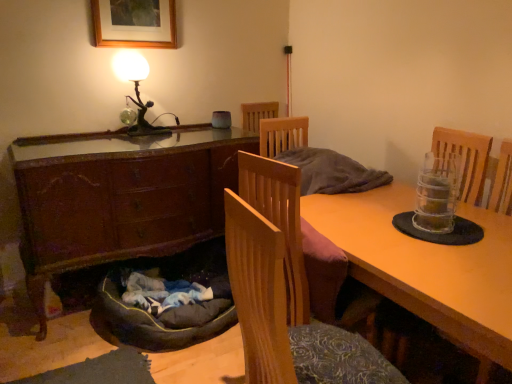
Question: Is wooden desk at center positioned beyond the bounds of wooden chair at center?

Choices:
 (A) yes
 (B) no

Answer: (A)

Question: Considering the relative positions of wooden desk at center and wooden chair at center in the image provided, is wooden desk at center to the right of wooden chair at center from the viewer's perspective?

Choices:
 (A) yes
 (B) no

Answer: (A)

Question: Could wooden chair at center be considered to be inside wooden desk at center?

Choices:
 (A) yes
 (B) no

Answer: (B)

Question: Is wooden desk at center facing towards wooden chair at center?

Choices:
 (A) no
 (B) yes

Answer: (B)

Question: From the image's perspective, is wooden desk at center located beneath wooden chair at center?

Choices:
 (A) yes
 (B) no

Answer: (A)

Question: From a real-world perspective, is wooden picture frame at upper center above or below metallic figure at upper left?

Choices:
 (A) above
 (B) below

Answer: (A)

Question: From the image's perspective, is wooden picture frame at upper center located above or below metallic figure at upper left?

Choices:
 (A) below
 (B) above

Answer: (B)

Question: Is wooden picture frame at upper center wider or thinner than metallic figure at upper left?

Choices:
 (A) wide
 (B) thin

Answer: (B)

Question: Is wooden picture frame at upper center taller or shorter than metallic figure at upper left?

Choices:
 (A) short
 (B) tall

Answer: (A)

Question: Is wooden chair at center inside the boundaries of wooden cabinet at lower left, or outside?

Choices:
 (A) outside
 (B) inside

Answer: (A)

Question: In the image, is wooden chair at center positioned in front of or behind wooden cabinet at lower left?

Choices:
 (A) behind
 (B) front

Answer: (B)

Question: Is point (314, 350) positioned closer to the camera than point (81, 183)?

Choices:
 (A) closer
 (B) farther

Answer: (A)

Question: Is wooden chair at center bigger or smaller than wooden cabinet at lower left?

Choices:
 (A) small
 (B) big

Answer: (A)

Question: Considering the positions of wooden picture frame at upper center and wooden chair at center in the image, is wooden picture frame at upper center bigger or smaller than wooden chair at center?

Choices:
 (A) small
 (B) big

Answer: (A)

Question: Is wooden picture frame at upper center wider or thinner than wooden chair at center?

Choices:
 (A) wide
 (B) thin

Answer: (B)